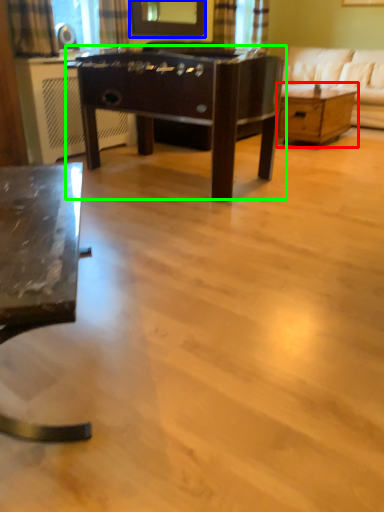
Question: Which object is positioned closest to table (highlighted by a red box)? Select from mirror (highlighted by a blue box) and table (highlighted by a green box).

Choices:
 (A) mirror
 (B) table

Answer: (A)